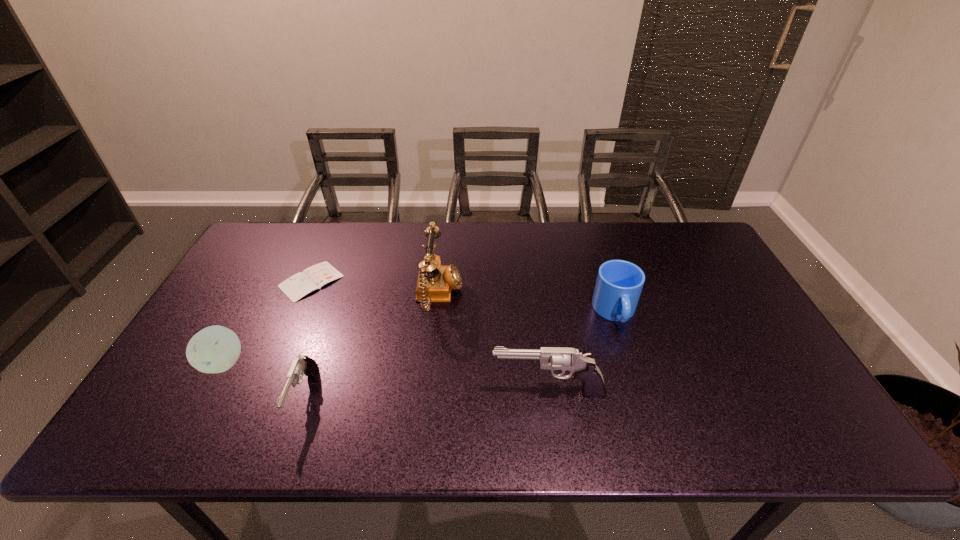
Please point a spot to add another gun on the right. Please provide its 2D coordinates. Your answer should be formatted as a tuple, i.e. [(x, y)], where the tuple contains the x and y coordinates of a point satisfying the conditions above.

[(788, 387)]